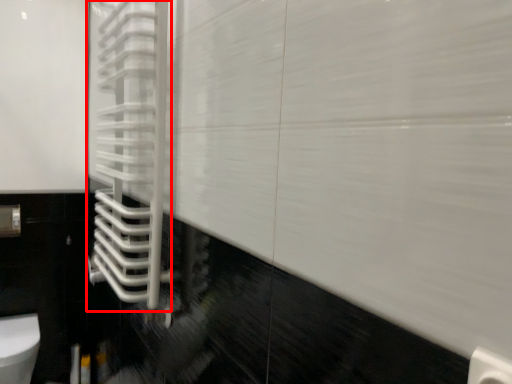
Question: Considering the relative positions of shower door (annotated by the red box) and toilet in the image provided, where is shower door (annotated by the red box) located with respect to the staircase?

Choices:
 (A) left
 (B) right

Answer: (B)